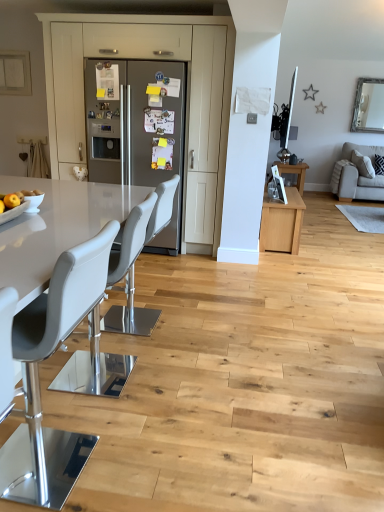
Identify the location of vacant area on the back side of white leather chair at center, the 1th chair viewed from the back. (149, 300).